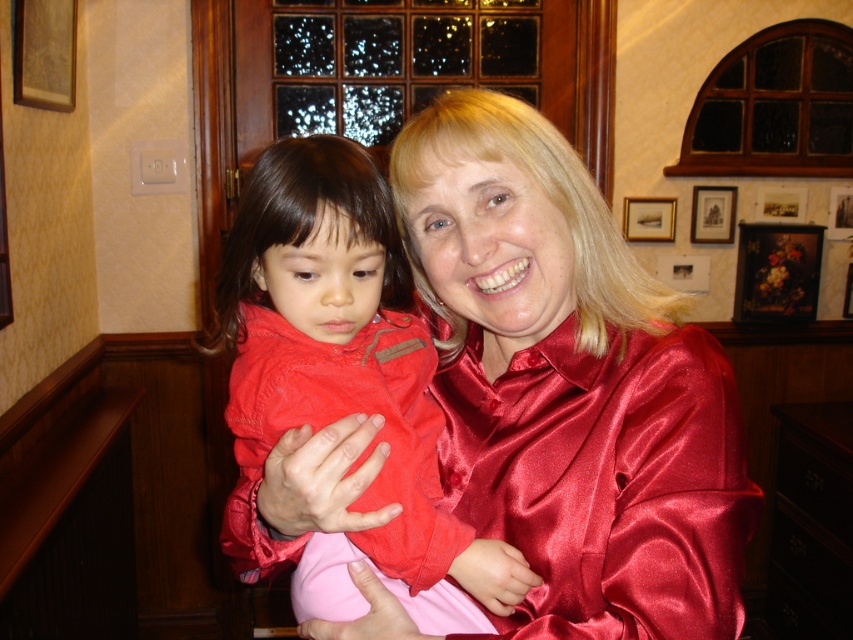
Is satin red blouse at center wider than matte red jacket at center?

Yes.

Is satin red blouse at center below matte red jacket at center?

No, satin red blouse at center is not below matte red jacket at center.

Is point (525, 305) less distant than point (285, 381)?

That is False.

Find the location of a particular element. satin red blouse at center is located at coordinates (570, 385).